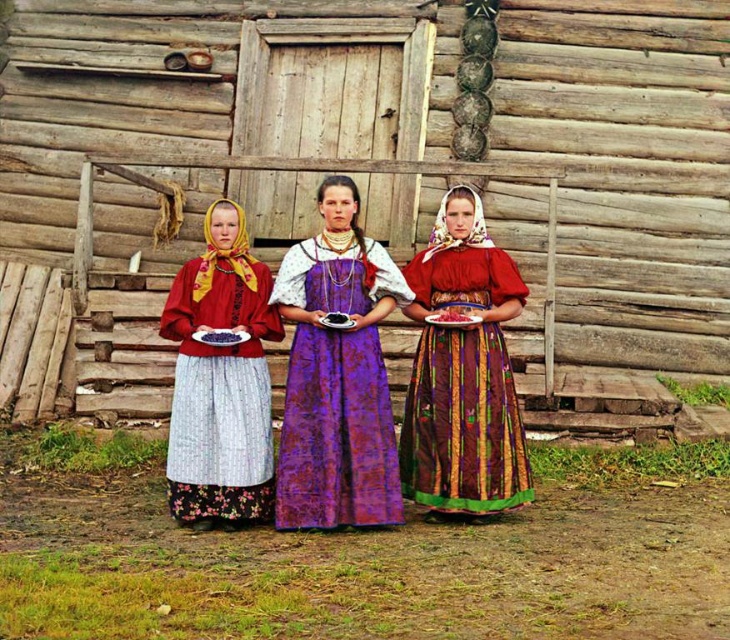
Question: Which point is farther to the camera?

Choices:
 (A) matte red dress at center
 (B) purple brocade dress at center
 (C) matte red blouse at center
 (D) red glossy plate at center

Answer: (D)

Question: Does purple brocade dress at center appear on the right side of red glossy plate at center?

Choices:
 (A) yes
 (B) no

Answer: (B)

Question: Among these objects, which one is nearest to the camera?

Choices:
 (A) matte red dress at center
 (B) purple brocade dress at center
 (C) matte red blouse at center

Answer: (B)

Question: Observing the image, what is the correct spatial positioning of purple brocade dress at center in reference to matte red blouse at center?

Choices:
 (A) above
 (B) below

Answer: (A)

Question: Can you confirm if purple brocade dress at center is wider than matte red blouse at center?

Choices:
 (A) no
 (B) yes

Answer: (B)

Question: Which point is farther from the camera taking this photo?

Choices:
 (A) (480, 419)
 (B) (449, 321)
 (C) (328, 212)

Answer: (C)